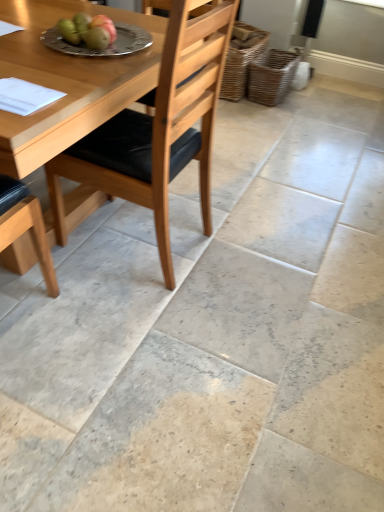
This screenshot has height=512, width=384. Find the location of `vacant area that is in front of green matte apple at upper left, the 2th fruit from the right`. vacant area that is in front of green matte apple at upper left, the 2th fruit from the right is located at coordinates (51, 57).